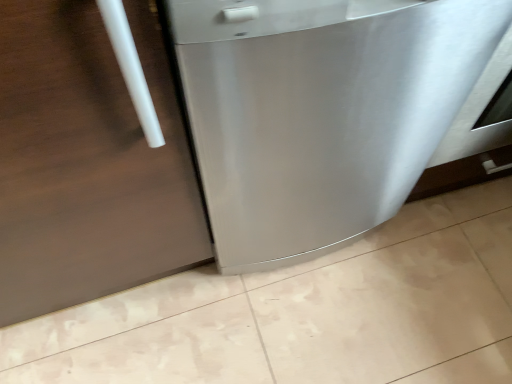
Measure the distance between point (66,183) and camera.

Point (66,183) is 22.83 inches away from camera.

What do you see at coordinates (87, 162) in the screenshot? I see `stainless steel door at left` at bounding box center [87, 162].

Identify the location of stainless steel door at left. (87, 162).

Locate an element on the screen. The height and width of the screenshot is (384, 512). stainless steel dishwasher at center is located at coordinates (320, 112).

What is the approximate width of stainless steel dishwasher at center?

26.47 inches.

What do you see at coordinates (320, 112) in the screenshot? This screenshot has height=384, width=512. I see `stainless steel dishwasher at center` at bounding box center [320, 112].

Identify the location of stainless steel door at left. (87, 162).

Is stainless steel dishwasher at center at the left side of stainless steel door at left?

No, stainless steel dishwasher at center is not to the left of stainless steel door at left.

Relative to stainless steel door at left, is stainless steel dishwasher at center in front or behind?

stainless steel dishwasher at center is positioned farther from the viewer than stainless steel door at left.

Is point (274, 9) closer to camera compared to point (122, 176)?

Yes, point (274, 9) is closer to viewer.

From the image's perspective, is stainless steel dishwasher at center under stainless steel door at left?

No, from the image's perspective, stainless steel dishwasher at center is not below stainless steel door at left.

From the picture: From a real-world perspective, is stainless steel dishwasher at center physically below stainless steel door at left?

Yes, from a real-world perspective, stainless steel dishwasher at center is below stainless steel door at left.

Which object is thinner, stainless steel dishwasher at center or stainless steel door at left?

stainless steel door at left.

From their relative heights in the image, would you say stainless steel dishwasher at center is taller or shorter than stainless steel door at left?

Clearly, stainless steel dishwasher at center is shorter compared to stainless steel door at left.

Between stainless steel dishwasher at center and stainless steel door at left, which one has smaller size?

Smaller between the two is stainless steel dishwasher at center.

Would you say stainless steel dishwasher at center contains stainless steel door at left?

No, stainless steel door at left is located outside of stainless steel dishwasher at center.

Are stainless steel dishwasher at center and stainless steel door at left far apart?

No, stainless steel dishwasher at center is not far away from stainless steel door at left.

Is stainless steel dishwasher at center facing towards stainless steel door at left?

No, stainless steel dishwasher at center is not facing towards stainless steel door at left.

This screenshot has height=384, width=512. In the image, there is a stainless steel door at left. Identify the location of home appliance below it (from a real-world perspective). (320, 112).

Looking at this image, can you confirm if stainless steel door at left is positioned to the right of stainless steel dishwasher at center?

In fact, stainless steel door at left is to the left of stainless steel dishwasher at center.

In the image, is stainless steel door at left positioned in front of or behind stainless steel dishwasher at center?

stainless steel door at left is in front of stainless steel dishwasher at center.

Considering the positions of points (128, 190) and (298, 197), is point (128, 190) closer to camera compared to point (298, 197)?

That is True.

From the image's perspective, is stainless steel door at left on top of stainless steel dishwasher at center?

No, from the image's perspective, stainless steel door at left is not on top of stainless steel dishwasher at center.

From a real-world perspective, who is located lower, stainless steel door at left or stainless steel dishwasher at center?

From a 3D spatial view, stainless steel dishwasher at center is below.

Is stainless steel door at left thinner than stainless steel dishwasher at center?

Yes, stainless steel door at left is thinner than stainless steel dishwasher at center.

Can you confirm if stainless steel door at left is taller than stainless steel dishwasher at center?

Yes.

Considering the sizes of stainless steel door at left and stainless steel dishwasher at center in the image, is stainless steel door at left bigger or smaller than stainless steel dishwasher at center?

stainless steel door at left is bigger than stainless steel dishwasher at center.

Is stainless steel door at left completely or partially outside of stainless steel dishwasher at center?

That's correct, stainless steel door at left is outside of stainless steel dishwasher at center.

Is stainless steel door at left far from stainless steel dishwasher at center?

No, there isn't a large distance between stainless steel door at left and stainless steel dishwasher at center.

Is stainless steel dishwasher at center at the back of stainless steel door at left?

stainless steel door at left is not turned away from stainless steel dishwasher at center.

How many degrees apart are the facing directions of stainless steel door at left and stainless steel dishwasher at center?

stainless steel door at left and stainless steel dishwasher at center are facing 1.58 degrees away from each other.

How much distance is there between stainless steel door at left and stainless steel dishwasher at center?

A distance of 19.66 centimeters exists between stainless steel door at left and stainless steel dishwasher at center.

Where is `home appliance behind the stainless steel door at left`? home appliance behind the stainless steel door at left is located at coordinates (320, 112).

Locate an element on the screen. Image resolution: width=512 pixels, height=384 pixels. door that appears in front of the stainless steel dishwasher at center is located at coordinates (87, 162).

Find the location of a particular element. The height and width of the screenshot is (384, 512). door on the left of stainless steel dishwasher at center is located at coordinates (87, 162).